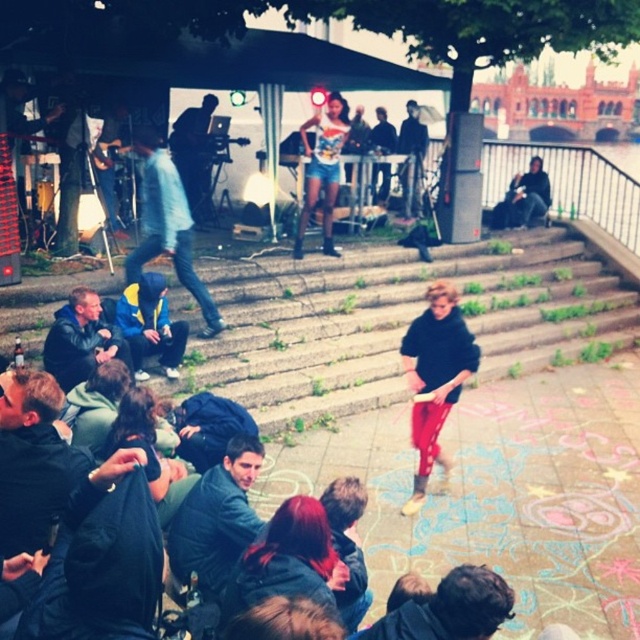
You are a photographer standing at the top of the concrete steps. You want to take a photo that includes both the leather jacket at lower left and the dark blue jeans at center. What is the minimum distance you need to move forward to ensure both are in frame?

You need to move forward at least 25.07 feet to ensure both the leather jacket at lower left and the dark blue jeans at center are in frame.

You are standing at the bottom of the concrete steps and want to walk towards the person holding the paper. Which point, point 1 at coordinates [131,275] or point 2 at coordinates [65,381], is closer to your current position?

Point 2 at coordinates [65,381] is closer to your current position because it is closer to the camera than point 1 at coordinates [131,275].

You are standing at the point with coordinates point (88, 356) and want to move towards the point with coordinates point (445, 576). Which direction should you move?

You should move towards the point (445, 576) because it is closer to you than the point (88, 356).